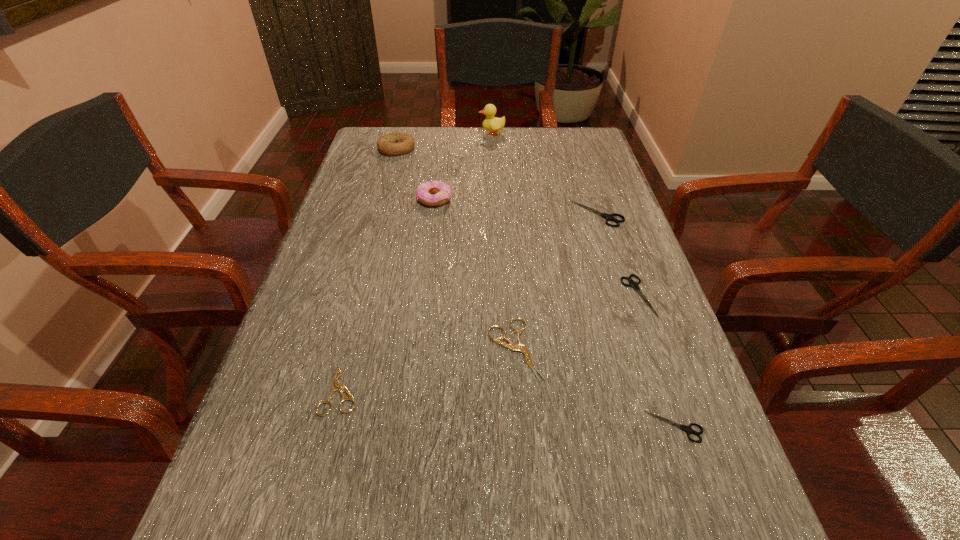
Image resolution: width=960 pixels, height=540 pixels. Identify the location of free point that satisfies the following two spatial constraints: 1. on the front-facing side of the second biggest black shears; 2. on the right side of the duckling. 498,295.

Find the location of a particular element. vacant space that satisfies the following two spatial constraints: 1. on the front-facing side of the tallest object; 2. on the left side of the nearest black shears is located at coordinates pyautogui.click(x=504, y=427).